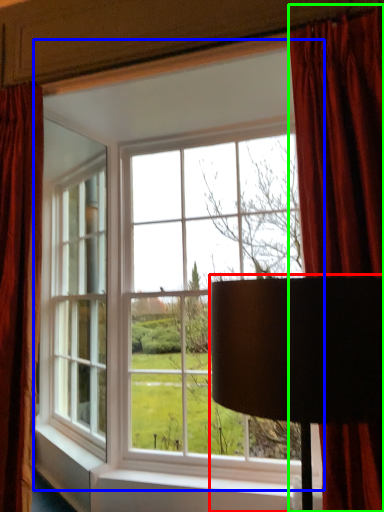
Question: Which is nearer to the table lamp (highlighted by a red box)? window (highlighted by a blue box) or curtain (highlighted by a green box).

Choices:
 (A) window
 (B) curtain

Answer: (B)